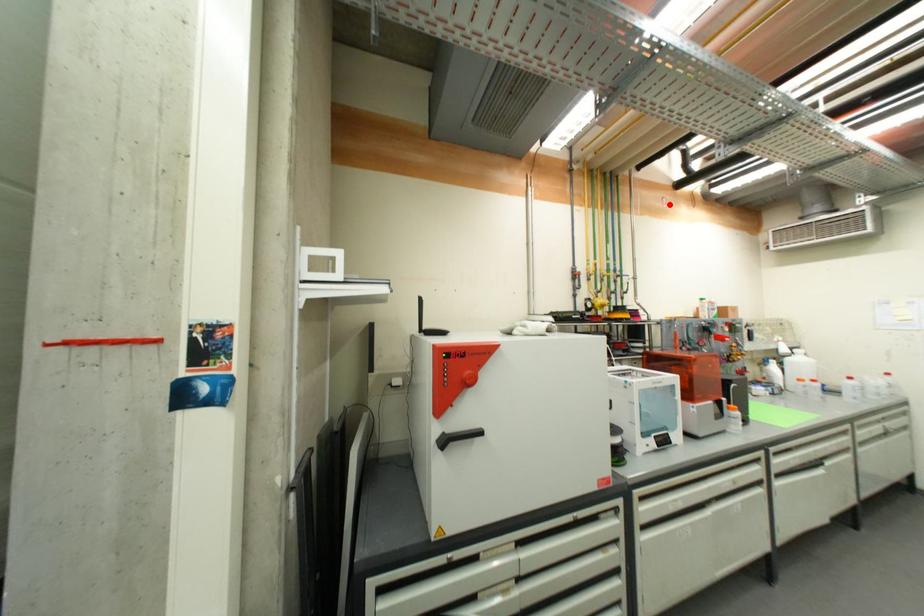
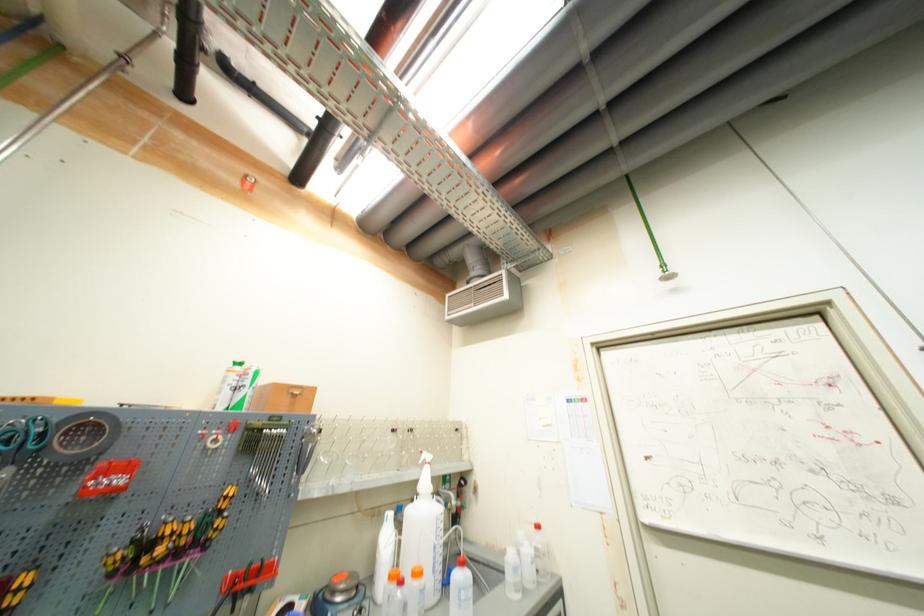
Locate, in the second image, the point that corresponds to the highlighted location in the first image.

(253, 185)